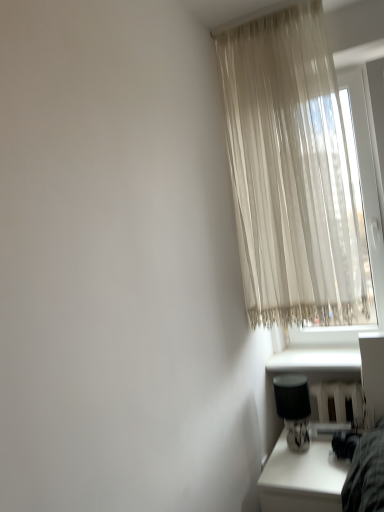
Question: Is white smooth window sill at lower right facing towards sheer beige curtain at upper right?

Choices:
 (A) no
 (B) yes

Answer: (A)

Question: Does white smooth window sill at lower right have a lesser width compared to sheer beige curtain at upper right?

Choices:
 (A) no
 (B) yes

Answer: (A)

Question: From a real-world perspective, is white smooth window sill at lower right positioned over sheer beige curtain at upper right based on gravity?

Choices:
 (A) no
 (B) yes

Answer: (A)

Question: Can you confirm if white smooth window sill at lower right is positioned to the left of sheer beige curtain at upper right?

Choices:
 (A) yes
 (B) no

Answer: (B)

Question: Does white smooth window sill at lower right have a smaller size compared to sheer beige curtain at upper right?

Choices:
 (A) no
 (B) yes

Answer: (B)

Question: In terms of size, does sheer beige curtain at upper right appear bigger or smaller than black fabric table lamp at lower right?

Choices:
 (A) small
 (B) big

Answer: (B)

Question: From a real-world perspective, is sheer beige curtain at upper right above or below black fabric table lamp at lower right?

Choices:
 (A) above
 (B) below

Answer: (A)

Question: From their relative heights in the image, would you say sheer beige curtain at upper right is taller or shorter than black fabric table lamp at lower right?

Choices:
 (A) tall
 (B) short

Answer: (A)

Question: Looking at their shapes, would you say sheer beige curtain at upper right is wider or thinner than black fabric table lamp at lower right?

Choices:
 (A) wide
 (B) thin

Answer: (A)

Question: Does point (243, 147) appear closer or farther from the camera than point (274, 486)?

Choices:
 (A) closer
 (B) farther

Answer: (B)

Question: From a real-world perspective, is sheer beige curtain at upper right physically located above or below white glossy table at lower right?

Choices:
 (A) above
 (B) below

Answer: (A)

Question: Visually, is sheer beige curtain at upper right positioned to the left or to the right of white glossy table at lower right?

Choices:
 (A) left
 (B) right

Answer: (A)

Question: Relative to white glossy table at lower right, is sheer beige curtain at upper right in front or behind?

Choices:
 (A) behind
 (B) front

Answer: (A)

Question: Is point (286, 414) positioned closer to the camera than point (258, 224)?

Choices:
 (A) farther
 (B) closer

Answer: (B)

Question: Is black fabric table lamp at lower right wider or thinner than sheer beige curtain at upper right?

Choices:
 (A) wide
 (B) thin

Answer: (B)